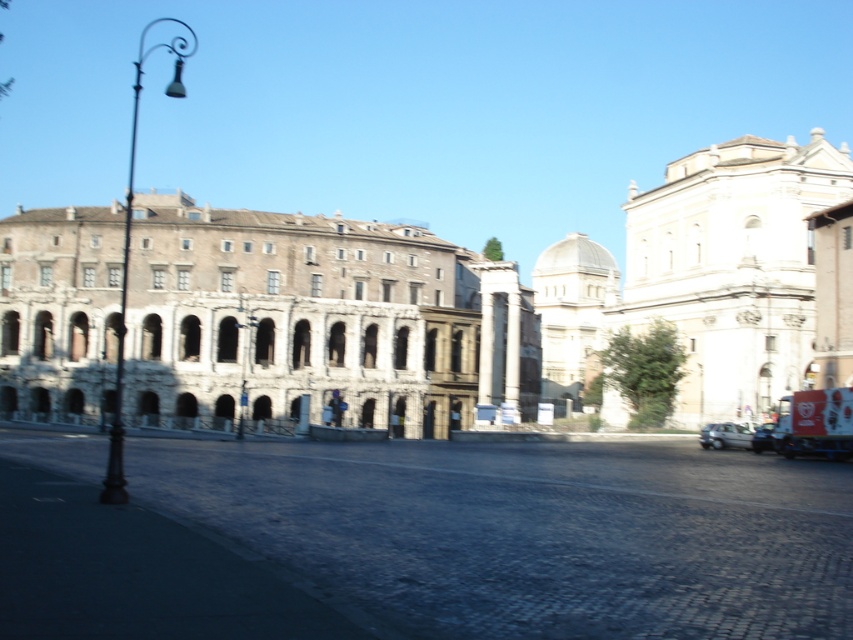
Question: Among these objects, which one is farthest from the camera?

Choices:
 (A) metallic silver car at lower right
 (B) beige stone building at upper right

Answer: (B)

Question: Which object is the farthest from the beige stone building at upper right?

Choices:
 (A) silver metallic car at lower right
 (B) stone/brick building at center
 (C) metallic silver car at lower right

Answer: (A)

Question: Is silver metallic car at lower right below metallic silver car at lower right?

Choices:
 (A) yes
 (B) no

Answer: (B)

Question: Observing the image, what is the correct spatial positioning of stone/brick building at center in reference to beige stone building at upper right?

Choices:
 (A) left
 (B) right

Answer: (A)

Question: Which of the following is the closest to the observer?

Choices:
 (A) (189, 353)
 (B) (772, 440)
 (C) (726, 422)

Answer: (B)

Question: Can you confirm if stone/brick building at center is bigger than silver metallic car at lower right?

Choices:
 (A) yes
 (B) no

Answer: (A)